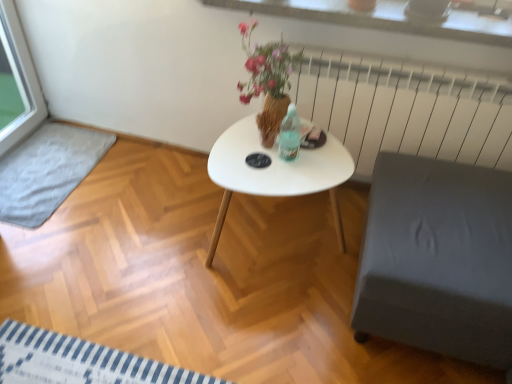
The height and width of the screenshot is (384, 512). What are the coordinates of `white glossy table at center` in the screenshot? It's located at (207, 277).

At what (x,y) coordinates should I click in order to perform the action: click on white metal radiator at upper right. Please return your answer as a coordinate pair (x, y). Image resolution: width=512 pixels, height=384 pixels. Looking at the image, I should click on (405, 110).

This screenshot has width=512, height=384. What are the coordinates of `white textured stone at upper center` in the screenshot? It's located at (388, 18).

What do you see at coordinates (47, 171) in the screenshot? I see `gray fabric mat at lower left` at bounding box center [47, 171].

This screenshot has width=512, height=384. I want to click on gray fabric mat at lower left, so click(x=47, y=171).

The width and height of the screenshot is (512, 384). I want to click on white glossy table at center, so click(207, 277).

Would you say white glossy table at center is a long distance from white textured stone at upper center?

That's right, there is a large distance between white glossy table at center and white textured stone at upper center.

Could you tell me if white glossy table at center is facing white textured stone at upper center?

No, white glossy table at center is not oriented towards white textured stone at upper center.

Does white glossy table at center appear on the right side of white textured stone at upper center?

No, white glossy table at center is not to the right of white textured stone at upper center.

Between white glossy table at center and white textured stone at upper center, which one has less height?

white textured stone at upper center is shorter.

In the scene shown: How far apart are white matte coffee table at center and white textured stone at upper center?

22.67 inches.

Based on the photo, from a real-world perspective, who is located lower, white matte coffee table at center or white textured stone at upper center?

white matte coffee table at center, from a real-world perspective.

At what (x,y) coordinates should I click in order to perform the action: click on window sill lying on the right of white matte coffee table at center. Please return your answer as a coordinate pair (x, y). This screenshot has height=384, width=512. Looking at the image, I should click on (388, 18).

Is point (278, 172) closer or farther from the camera than point (262, 6)?

Point (278, 172) is closer to the camera than point (262, 6).

Based on the photo, from a real-world perspective, which object rests below the other?

white metal radiator at upper right.

Which is more to the right, white metal radiator at upper right or white textured stone at upper center?

white metal radiator at upper right.

Is white textured stone at upper center at the back of white metal radiator at upper right?

That's not correct — white metal radiator at upper right is not looking away from white textured stone at upper center.

How many degrees apart are the facing directions of white metal radiator at upper right and white textured stone at upper center?

They differ by 0.16 degrees in their facing directions.

From a real-world perspective, who is located higher, gray fabric ottoman at lower right or white matte coffee table at center?

In real-world perspective, gray fabric ottoman at lower right is above.

Does point (453, 163) lie in front of point (221, 203)?

Yes, it is.

Considering the relative sizes of gray fabric ottoman at lower right and white matte coffee table at center in the image provided, is gray fabric ottoman at lower right wider than white matte coffee table at center?

Indeed, gray fabric ottoman at lower right has a greater width compared to white matte coffee table at center.

Considering the sizes of objects white glossy table at center and white metal radiator at upper right in the image provided, who is bigger, white glossy table at center or white metal radiator at upper right?

white glossy table at center.

In the scene shown: From a real-world perspective, is white glossy table at center on white metal radiator at upper right?

No.

How many degrees apart are the facing directions of white glossy table at center and white metal radiator at upper right?

The angular difference between white glossy table at center and white metal radiator at upper right is 0.462 degrees.

Is white glossy table at center looking in the opposite direction of white metal radiator at upper right?

No, white glossy table at center is not facing the opposite direction of white metal radiator at upper right.

Can you confirm if white textured stone at upper center is positioned to the right of gray fabric ottoman at lower right?

No, white textured stone at upper center is not to the right of gray fabric ottoman at lower right.

Considering the sizes of white textured stone at upper center and gray fabric ottoman at lower right in the image, is white textured stone at upper center wider or thinner than gray fabric ottoman at lower right?

Considering their sizes, white textured stone at upper center looks slimmer than gray fabric ottoman at lower right.

Is white textured stone at upper center situated inside gray fabric ottoman at lower right or outside?

white textured stone at upper center is spatially situated outside gray fabric ottoman at lower right.

Find the location of a particular element. coffee table below the white metal radiator at upper right (from the image's perspective) is located at coordinates (274, 172).

Considering the sizes of objects white matte coffee table at center and white metal radiator at upper right in the image provided, who is thinner, white matte coffee table at center or white metal radiator at upper right?

With smaller width is white metal radiator at upper right.

Which point is more distant from viewer, (348, 175) or (471, 130)?

The point (471, 130) is farther.

The image size is (512, 384). In order to click on window sill above the white glossy table at center (from the image's perspective) in this screenshot , I will do `click(388, 18)`.

This screenshot has width=512, height=384. In order to click on window sill on the right of white matte coffee table at center in this screenshot , I will do `click(388, 18)`.

When comparing their distances from gray fabric ottoman at lower right, does gray fabric mat at lower left or white textured stone at upper center seem further?

gray fabric mat at lower left.

Estimate the real-world distances between objects in this image. Which object is closer to white metal radiator at upper right, white glossy table at center or white textured stone at upper center?

white textured stone at upper center.

Based on their spatial positions, is gray fabric mat at lower left or gray fabric ottoman at lower right further from white textured stone at upper center?

gray fabric mat at lower left is further to white textured stone at upper center.

Looking at the image, which one is located further to gray fabric ottoman at lower right, white metal radiator at upper right or white matte coffee table at center?

white metal radiator at upper right is further to gray fabric ottoman at lower right.

When comparing their distances from gray fabric ottoman at lower right, does white glossy table at center or gray fabric mat at lower left seem further?

gray fabric mat at lower left is further to gray fabric ottoman at lower right.

In the scene shown: Looking at the image, which one is located further to white glossy table at center, gray fabric ottoman at lower right or white textured stone at upper center?

white textured stone at upper center is further to white glossy table at center.

Looking at the image, which one is located further to gray fabric mat at lower left, white textured stone at upper center or white glossy table at center?

white textured stone at upper center.

Based on their spatial positions, is white matte coffee table at center or white textured stone at upper center closer to gray fabric mat at lower left?

white matte coffee table at center lies closer to gray fabric mat at lower left than the other object.

Identify the location of coffee table between white glossy table at center and white metal radiator at upper right. (274, 172).

The height and width of the screenshot is (384, 512). In order to click on radiator between gray fabric mat at lower left and gray fabric ottoman at lower right from left to right in this screenshot , I will do `click(405, 110)`.

This screenshot has height=384, width=512. Identify the location of armchair between white textured stone at upper center and white glossy table at center in the vertical direction. (438, 259).

Locate an element on the screen. This screenshot has height=384, width=512. coffee table between gray fabric mat at lower left and white textured stone at upper center is located at coordinates (274, 172).